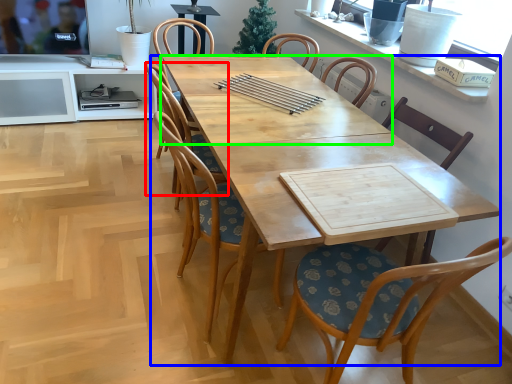
Question: Which object is positioned closest to chair (highlighted by a red box)? Select from desk (highlighted by a blue box) and kitchen & dining room table (highlighted by a green box).

Choices:
 (A) desk
 (B) kitchen & dining room table

Answer: (B)